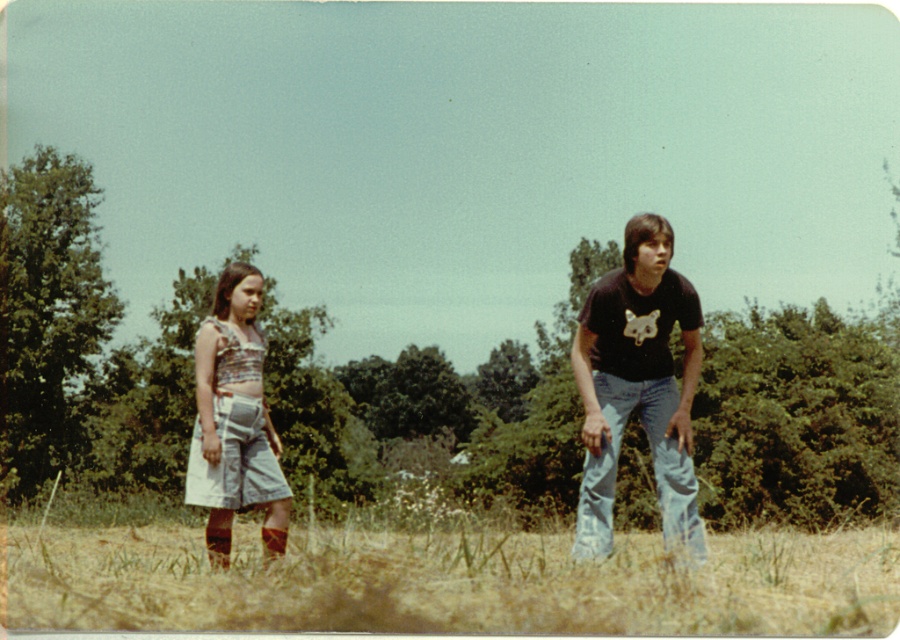
Describe the element at coordinates (447, 580) in the screenshot. I see `grassy field at lower center` at that location.

Is grassy field at lower center above denim shorts at left?

Actually, grassy field at lower center is below denim shorts at left.

Does point (87, 595) come farther from viewer compared to point (194, 438)?

No, it is not.

Identify the location of grassy field at lower center. The height and width of the screenshot is (640, 900). (447, 580).

Can you confirm if grassy field at lower center is bigger than black cotton shirt at right?

Yes.

Is grassy field at lower center shorter than black cotton shirt at right?

In fact, grassy field at lower center may be taller than black cotton shirt at right.

Describe the element at coordinates (447, 580) in the screenshot. I see `grassy field at lower center` at that location.

Where is `grassy field at lower center`? The height and width of the screenshot is (640, 900). grassy field at lower center is located at coordinates (447, 580).

Consider the image. Is black cotton shirt at right below denim shorts at left?

No.

Who is more forward, (579, 525) or (274, 490)?

Point (579, 525) is more forward.

Identify the location of black cotton shirt at right. The image size is (900, 640). (637, 385).